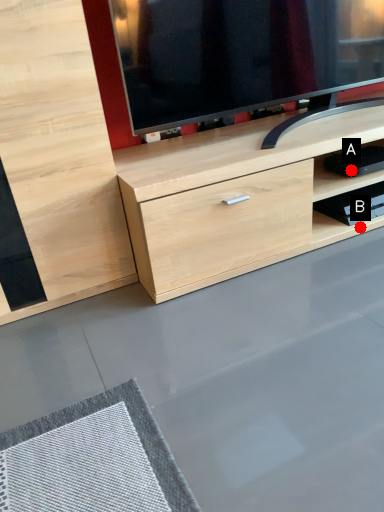
Question: Two points are circled on the image, labeled by A and B beside each circle. Among these points, which one is farthest from the camera?

Choices:
 (A) A is further
 (B) B is further

Answer: (B)